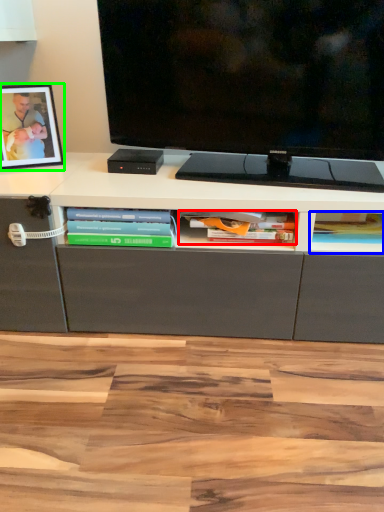
Question: Which is farther away from book (highlighted by a red box)? book (highlighted by a blue box) or picture frame (highlighted by a green box)?

Choices:
 (A) book
 (B) picture frame

Answer: (B)